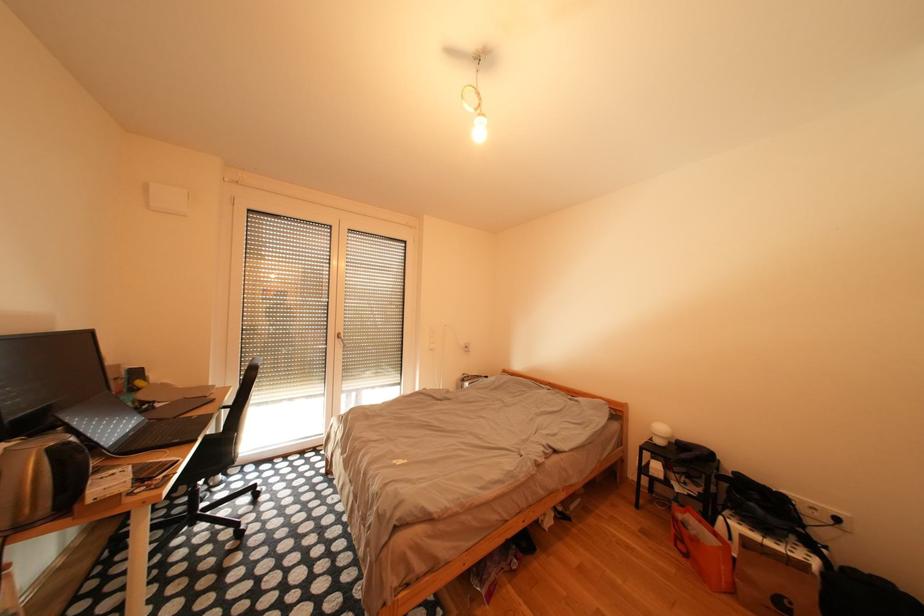
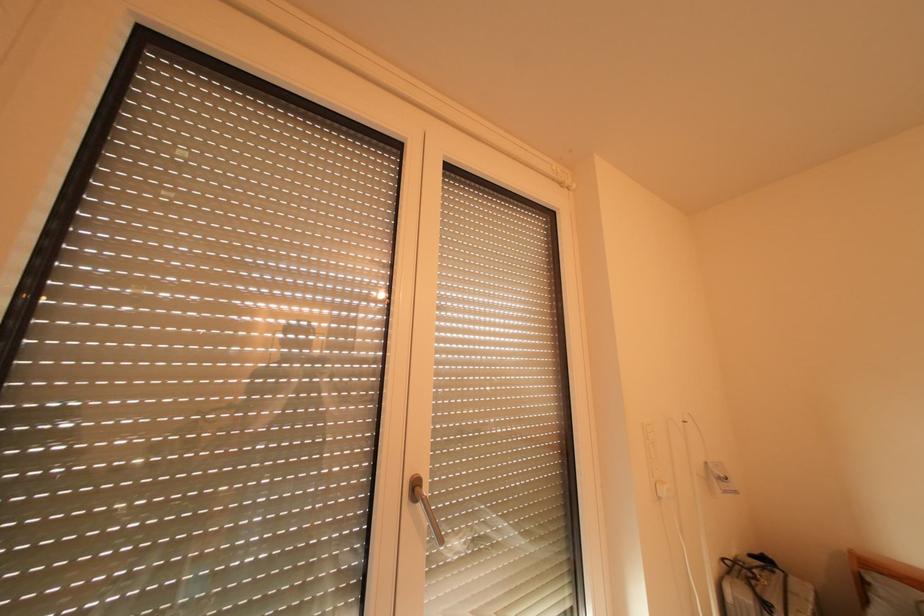
From the picture: What movement of the cameraman would produce the second image?

The cameraman moved toward left, forward.